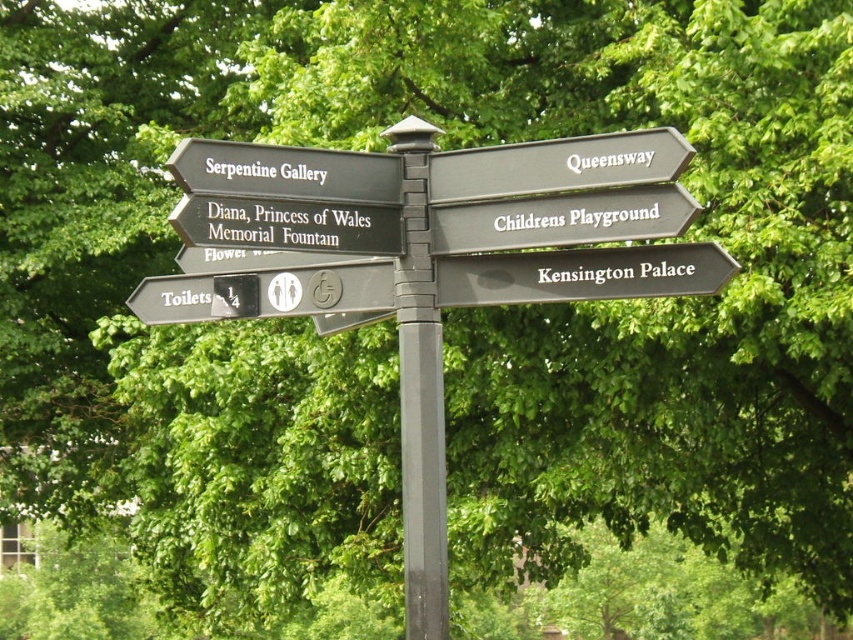
Question: Does black plastic pole at center come behind black metal sign at center?

Choices:
 (A) yes
 (B) no

Answer: (A)

Question: Is black matte signpost at lower right smaller than black plastic sign at upper center?

Choices:
 (A) yes
 (B) no

Answer: (A)

Question: Estimate the real-world distances between objects in this image. Which object is farther from the green matte sign at lower left?

Choices:
 (A) black matte signpost at lower right
 (B) black matte sign at center
 (C) black matte sign at upper left

Answer: (A)

Question: Which point appears farthest from the camera in this image?

Choices:
 (A) (397, 163)
 (B) (585, 164)
 (C) (523, 211)

Answer: (A)

Question: Which of the following is the closest to the observer?

Choices:
 (A) (358, 276)
 (B) (563, 202)
 (C) (305, 212)

Answer: (C)

Question: Is black matte sign at upper left below black matte sign at center?

Choices:
 (A) yes
 (B) no

Answer: (B)